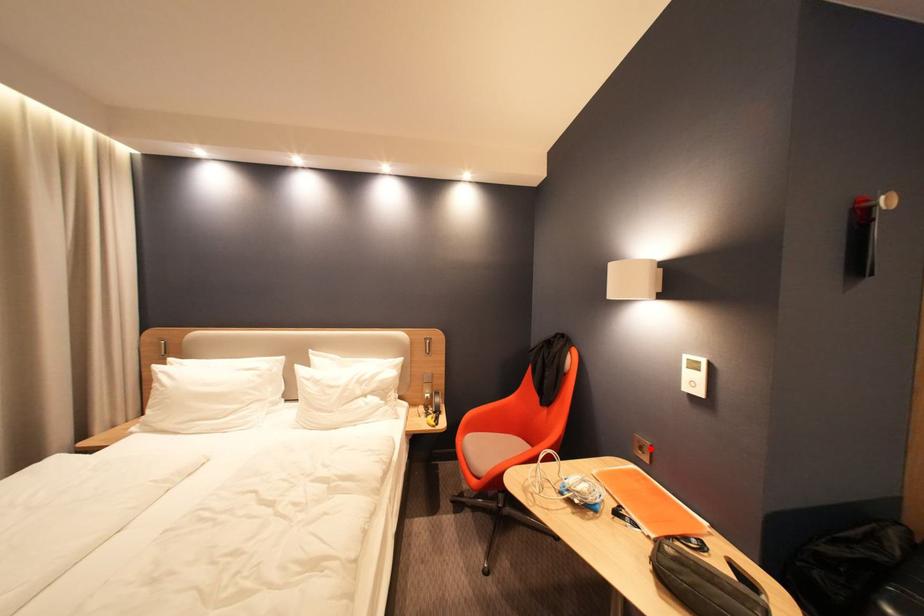
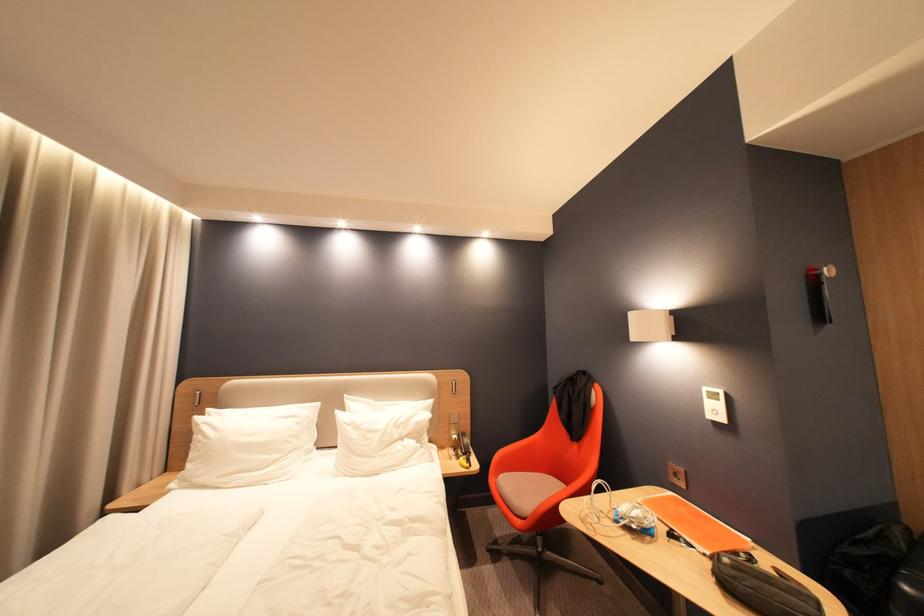
Question: I am providing you with two images of the same scene from different viewpoints. A red point is marked on the first image. Is the red point's position out of view in image 2?

Choices:
 (A) Yes
 (B) No

Answer: (B)